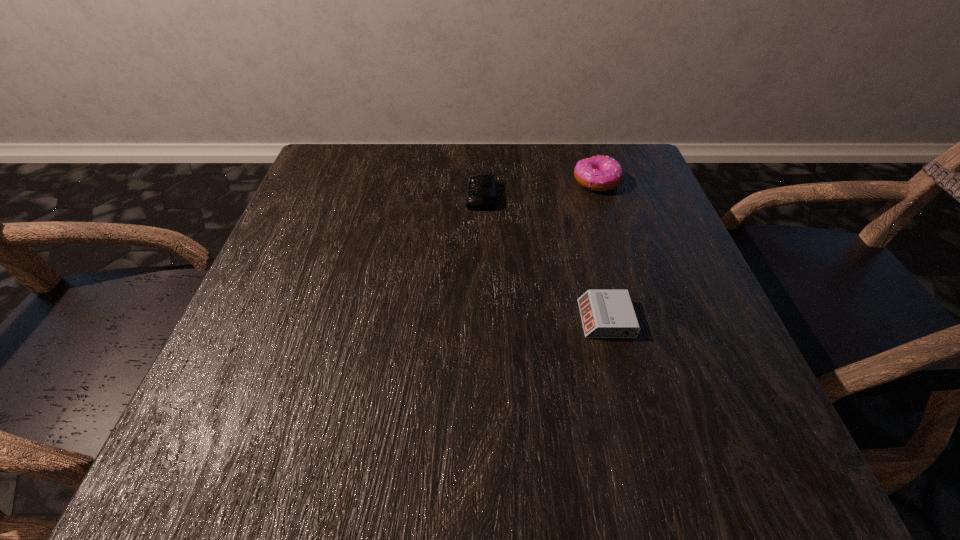
Identify the location of vacant region between the right alarm clock and the left alarm clock. (543, 258).

Identify which object is located as the nearest to the farther alarm clock. Please provide its 2D coordinates. Your answer should be formatted as a tuple, i.e. [(x, y)], where the tuple contains the x and y coordinates of a point satisfying the conditions above.

[(601, 173)]

Select which object appears as the closest to the left alarm clock. Please provide its 2D coordinates. Your answer should be formatted as a tuple, i.e. [(x, y)], where the tuple contains the x and y coordinates of a point satisfying the conditions above.

[(601, 173)]

Where is `free region that satisfies the following two spatial constraints: 1. on the front side of the tallest object; 2. on the display of the leftmost object`? The image size is (960, 540). free region that satisfies the following two spatial constraints: 1. on the front side of the tallest object; 2. on the display of the leftmost object is located at coordinates (602, 196).

At what (x,y) coordinates should I click in order to perform the action: click on free region that satisfies the following two spatial constraints: 1. on the display of the left alarm clock; 2. on the left side of the nearest object. Please return your answer as a coordinate pair (x, y). Image resolution: width=960 pixels, height=540 pixels. Looking at the image, I should click on (481, 319).

You are a GUI agent. You are given a task and a screenshot of the screen. Output one action in this format:
    pyautogui.click(x=<x>, y=<y>)
    Task: Click on the free space that satisfies the following two spatial constraints: 1. on the display of the leftmost object; 2. on the back side of the nearer alarm clock
    
    Given the screenshot: What is the action you would take?
    [x=481, y=319]

Identify the location of free spot that satisfies the following two spatial constraints: 1. on the display of the right alarm clock; 2. on the left side of the farther alarm clock. Image resolution: width=960 pixels, height=540 pixels. (481, 319).

At what (x,y) coordinates should I click in order to perform the action: click on vacant region that satisfies the following two spatial constraints: 1. on the display of the nearest object; 2. on the left side of the farther alarm clock. Please return your answer as a coordinate pair (x, y). This screenshot has width=960, height=540. Looking at the image, I should click on (481, 319).

Image resolution: width=960 pixels, height=540 pixels. Identify the location of vacant space that satisfies the following two spatial constraints: 1. on the display of the nearest object; 2. on the right side of the leftmost object. (481, 319).

Where is `blank space that satisfies the following two spatial constraints: 1. on the display of the left alarm clock; 2. on the right side of the nearest object`? This screenshot has height=540, width=960. blank space that satisfies the following two spatial constraints: 1. on the display of the left alarm clock; 2. on the right side of the nearest object is located at coordinates pyautogui.click(x=481, y=319).